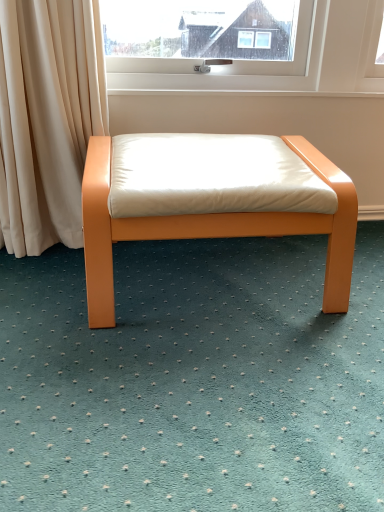
I want to click on vacant space underneath matte orange bench at center (from a real-world perspective), so click(x=218, y=273).